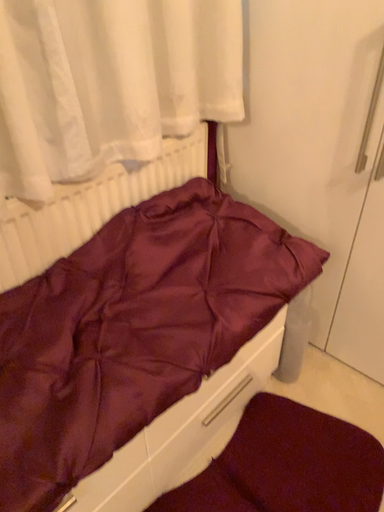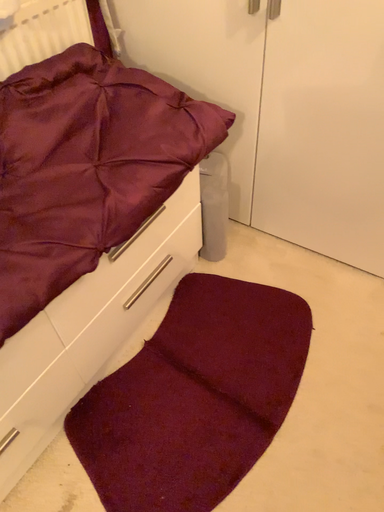
Question: Which way did the camera rotate in the video?

Choices:
 (A) rotated left
 (B) rotated right

Answer: (B)